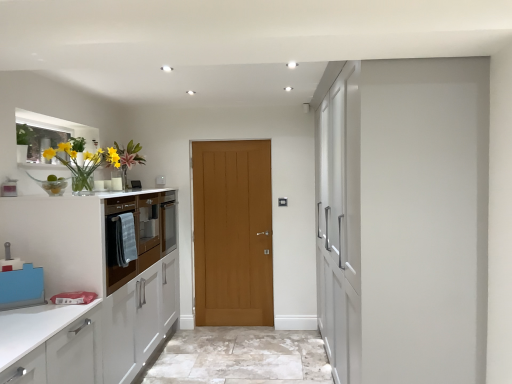
At what (x,y) coordinates should I click in order to perform the action: click on vacant area on top of wooden door at center (from a real-world perspective). Please return your answer as a coordinate pair (x, y). Looking at the image, I should click on (230, 139).